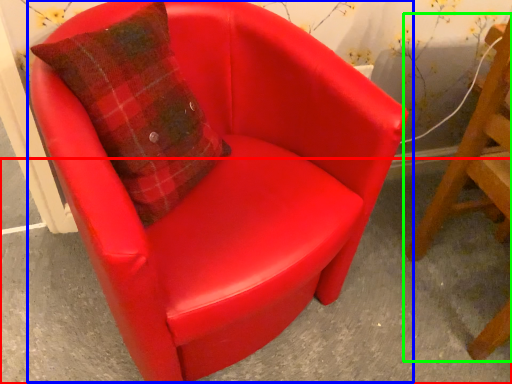
Question: Based on their relative distances, which object is farther from concrete (highlighted by a red box)? Choose from chair (highlighted by a blue box) and chair (highlighted by a green box).

Choices:
 (A) chair
 (B) chair

Answer: (A)